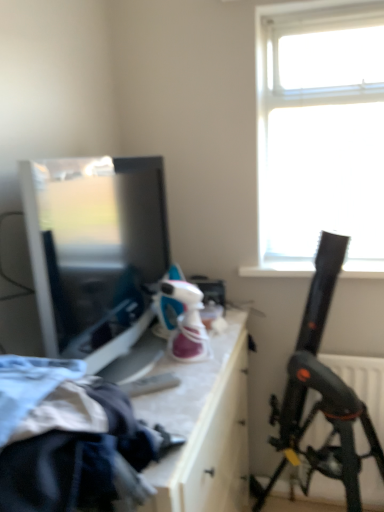
Question: Is matte black television at left looking in the opposite direction of white glossy drawer at center?

Choices:
 (A) yes
 (B) no

Answer: (B)

Question: Is matte black television at left shorter than white glossy drawer at center?

Choices:
 (A) no
 (B) yes

Answer: (B)

Question: Is matte black television at left next to white glossy drawer at center?

Choices:
 (A) no
 (B) yes

Answer: (A)

Question: Does matte black television at left have a greater width compared to white glossy drawer at center?

Choices:
 (A) yes
 (B) no

Answer: (B)

Question: Considering the relative positions of matte black television at left and white glossy drawer at center in the image provided, is matte black television at left to the left of white glossy drawer at center from the viewer's perspective?

Choices:
 (A) yes
 (B) no

Answer: (A)

Question: Does matte black television at left have a lesser width compared to white glossy drawer at center?

Choices:
 (A) yes
 (B) no

Answer: (A)

Question: Are white glossy drawer at center and black plastic telescope at right located far from each other?

Choices:
 (A) yes
 (B) no

Answer: (B)

Question: Is white glossy drawer at center surrounding black plastic telescope at right?

Choices:
 (A) yes
 (B) no

Answer: (B)

Question: From the image's perspective, would you say white glossy drawer at center is positioned over black plastic telescope at right?

Choices:
 (A) no
 (B) yes

Answer: (A)

Question: Is white glossy drawer at center at the left side of black plastic telescope at right?

Choices:
 (A) no
 (B) yes

Answer: (B)

Question: Is white glossy drawer at center not inside black plastic telescope at right?

Choices:
 (A) yes
 (B) no

Answer: (A)

Question: Does white glossy drawer at center have a lesser height compared to black plastic telescope at right?

Choices:
 (A) yes
 (B) no

Answer: (A)

Question: Is matte black television at left positioned beyond the bounds of black plastic telescope at right?

Choices:
 (A) no
 (B) yes

Answer: (B)